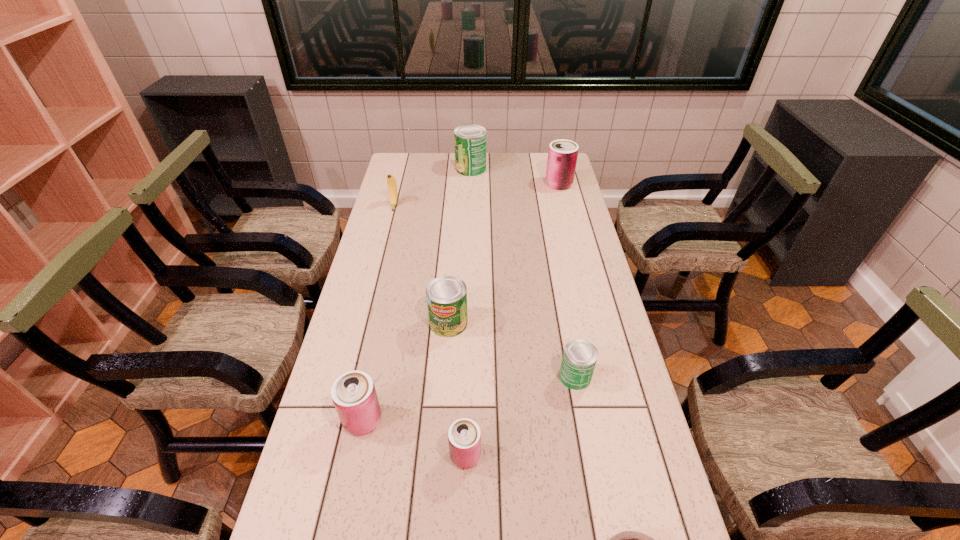
The width and height of the screenshot is (960, 540). What are the coordinates of `the smallest green can` in the screenshot? It's located at (579, 358).

Locate an element on the screen. This screenshot has width=960, height=540. the second pink can from right to left is located at coordinates (464, 436).

Where is `the nearest can`? The image size is (960, 540). the nearest can is located at coordinates (464, 436).

What are the coordinates of `free point located 0.270m on the right of the biggest green can` in the screenshot? It's located at (545, 168).

The image size is (960, 540). I want to click on vacant space located on the front of the farthest pink can, so click(x=567, y=219).

The width and height of the screenshot is (960, 540). What are the coordinates of `vacant space located from the stem of the sixth nearest object` in the screenshot? It's located at [x=383, y=251].

Identify the location of free space located on the front of the leftmost pink can. Image resolution: width=960 pixels, height=540 pixels. (348, 495).

Where is `vacant area situated on the front of the fourth farthest object`? Image resolution: width=960 pixels, height=540 pixels. vacant area situated on the front of the fourth farthest object is located at coordinates (438, 475).

At what (x,y) coordinates should I click in order to perform the action: click on vacant space located on the left of the rightmost green can. Please return your answer as a coordinate pair (x, y). The image size is (960, 540). Looking at the image, I should click on 500,377.

Identify the location of vacant space located 0.230m on the back of the second pink can from right to left. Image resolution: width=960 pixels, height=540 pixels. (468, 362).